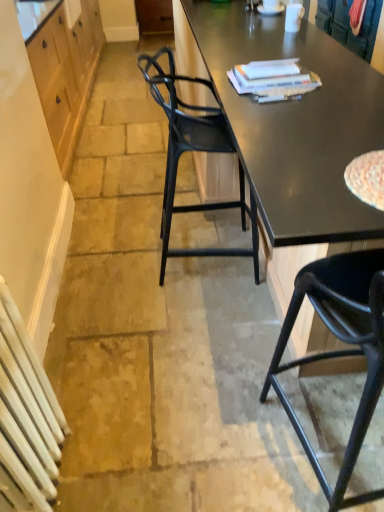
This screenshot has height=512, width=384. Describe the element at coordinates (342, 350) in the screenshot. I see `black plastic chair at lower right, which is the 2th chair in back-to-front order` at that location.

In order to face white matte plate at upper center, should I rotate leftwards or rightwards?

You should rotate right by 10.368 degrees.

Where is `white painted metal radiator at lower left`? The width and height of the screenshot is (384, 512). white painted metal radiator at lower left is located at coordinates (26, 418).

Find the location of a particular element. The height and width of the screenshot is (512, 384). black plastic chair at center, the first chair viewed from the back is located at coordinates (194, 151).

What do you see at coordinates (66, 73) in the screenshot? I see `wooden cabinet at left` at bounding box center [66, 73].

You are a GUI agent. You are given a task and a screenshot of the screen. Output one action in this format:
    pyautogui.click(x=<x>, y=<y>)
    Task: Click on the white glossy coffee cup at upper center
    The image size is (384, 512).
    Given the screenshot: What is the action you would take?
    pyautogui.click(x=293, y=16)

Is black plastic chair at center, acting as the 2th chair starting from the front, placed right next to white matte plate at upper center?

→ No, black plastic chair at center, acting as the 2th chair starting from the front, is not with white matte plate at upper center.

Is black plastic chair at center, the first chair viewed from the back, wider than white matte plate at upper center?

Correct, the width of black plastic chair at center, the first chair viewed from the back, exceeds that of white matte plate at upper center.

From the image's perspective, is black plastic chair at lower right, which is the 2th chair in back-to-front order, on top of wooden cabinet at left?

Actually, black plastic chair at lower right, which is the 2th chair in back-to-front order, appears below wooden cabinet at left in the image.

Does black plastic chair at lower right, which is the 2th chair in back-to-front order, have a greater width compared to wooden cabinet at left?

No.

Between point (331, 277) and point (96, 5), which one is positioned behind?

The point (96, 5) is farther from the camera.

Is black plastic chair at lower right, which is the 2th chair in back-to-front order, facing away from wooden cabinet at left?

That's not correct — black plastic chair at lower right, which is the 2th chair in back-to-front order, is not looking away from wooden cabinet at left.

Considering the sizes of objects wooden cabinet at left and white painted metal radiator at lower left in the image provided, who is thinner, wooden cabinet at left or white painted metal radiator at lower left?

With smaller width is white painted metal radiator at lower left.

From a real-world perspective, is wooden cabinet at left above or below white painted metal radiator at lower left?

From a real-world perspective, wooden cabinet at left is physically above white painted metal radiator at lower left.

What's the angular difference between wooden cabinet at left and white painted metal radiator at lower left's facing directions?

There is a 1.1-degree angle between the facing directions of wooden cabinet at left and white painted metal radiator at lower left.

Do you think wooden cabinet at left is within white painted metal radiator at lower left, or outside of it?

The correct answer is: outside.

Would you say wooden cabinet at upper left is inside or outside white painted metal radiator at lower left?

wooden cabinet at upper left is not enclosed by white painted metal radiator at lower left.

Is the surface of wooden cabinet at upper left in direct contact with white painted metal radiator at lower left?

No, wooden cabinet at upper left is not touching white painted metal radiator at lower left.

Visually, is wooden cabinet at upper left positioned to the left or to the right of white painted metal radiator at lower left?

In the image, wooden cabinet at upper left appears on the left side of white painted metal radiator at lower left.

Does point (54, 4) lie behind point (39, 387)?

That is True.

Is white glossy coffee cup at upper center looking in the opposite direction of wooden cabinet at left?

That's not correct — white glossy coffee cup at upper center is not looking away from wooden cabinet at left.

Locate an element on the screen. The image size is (384, 512). coffee cup that appears on the right of wooden cabinet at left is located at coordinates (293, 16).

From a real-world perspective, which is physically below, white glossy coffee cup at upper center or wooden cabinet at left?

From a 3D spatial view, wooden cabinet at left is below.

Is white glossy coffee cup at upper center far away from wooden cabinet at left?

That's right, there is a large distance between white glossy coffee cup at upper center and wooden cabinet at left.

Does wooden cabinet at upper left have a greater height compared to wooden cabinet at left?

No, wooden cabinet at upper left is not taller than wooden cabinet at left.

Is wooden cabinet at upper left in front of or behind wooden cabinet at left in the image?

wooden cabinet at upper left is positioned farther from the viewer than wooden cabinet at left.

Which object is positioned more to the left, wooden cabinet at upper left or wooden cabinet at left?

Positioned to the left is wooden cabinet at left.

Looking at this image, can wooden cabinet at left be found inside wooden cabinet at upper left?

No, wooden cabinet at left is located outside of wooden cabinet at upper left.

Is wooden cabinet at left surrounding black glossy desk at center?

Actually, black glossy desk at center is outside wooden cabinet at left.

Can you tell me how much wooden cabinet at left and black glossy desk at center differ in facing direction?

0.298 degrees separate the facing orientations of wooden cabinet at left and black glossy desk at center.

Looking at this image, is wooden cabinet at left positioned far away from black glossy desk at center?

Indeed, wooden cabinet at left is not near black glossy desk at center.

Considering their positions, is wooden cabinet at left located in front of or behind black glossy desk at center?

In the image, wooden cabinet at left appears behind black glossy desk at center.

Find the location of a particular element. The image size is (384, 512). the 1st chair positioned below the white matte plate at upper center (from the image's perspective) is located at coordinates (194, 151).

Where is `cabinetry below the black plastic chair at lower right, placed as the 1th chair when sorted from front to back (from a real-world perspective)`? This screenshot has width=384, height=512. cabinetry below the black plastic chair at lower right, placed as the 1th chair when sorted from front to back (from a real-world perspective) is located at coordinates (66, 73).

In the scene shown: Looking at the image, which one is located closer to wooden cabinet at upper left, black plastic chair at lower right, placed as the 1th chair when sorted from front to back, or wooden cabinet at left?

wooden cabinet at left.

Looking at this image, estimate the real-world distances between objects in this image. Which object is closer to white matte plate at upper center, wooden cabinet at left or black plastic chair at center, acting as the 2th chair starting from the front?

black plastic chair at center, acting as the 2th chair starting from the front, is closer to white matte plate at upper center.

Considering their positions, is black plastic chair at center, the first chair viewed from the back, positioned further to white glossy coffee cup at upper center than wooden cabinet at upper left?

wooden cabinet at upper left.

Estimate the real-world distances between objects in this image. Which object is further from white matte plate at upper center, black plastic chair at center, the first chair viewed from the back, or wooden cabinet at left?

wooden cabinet at left is positioned further to the anchor white matte plate at upper center.

Based on their spatial positions, is black plastic chair at center, the first chair viewed from the back, or black plastic chair at lower right, which is the 2th chair in back-to-front order, closer to white painted metal radiator at lower left?

Among the two, black plastic chair at lower right, which is the 2th chair in back-to-front order, is located nearer to white painted metal radiator at lower left.

Estimate the real-world distances between objects in this image. Which object is further from black glossy desk at center, wooden cabinet at left or black plastic chair at lower right, placed as the 1th chair when sorted from front to back?

wooden cabinet at left is further to black glossy desk at center.

Based on their spatial positions, is wooden cabinet at upper left or white matte plate at upper center further from black plastic chair at center, acting as the 2th chair starting from the front?

The object further to black plastic chair at center, acting as the 2th chair starting from the front, is white matte plate at upper center.

Based on their spatial positions, is wooden cabinet at upper left or white matte plate at upper center further from white painted metal radiator at lower left?

white matte plate at upper center.

Locate an element on the screen. coffee cup between black glossy desk at center and black plastic chair at lower right, which is the 2th chair in back-to-front order, in the vertical direction is located at coordinates click(293, 16).

Locate an element on the screen. cabinetry between black plastic chair at lower right, placed as the 1th chair when sorted from front to back, and wooden cabinet at upper left, along the z-axis is located at coordinates (66, 73).

Find the location of a particular element. desk between wooden cabinet at upper left and white glossy coffee cup at upper center is located at coordinates (291, 135).

At what (x,y) coordinates should I click in order to perform the action: click on plate between black glossy desk at center and black plastic chair at lower right, which is the 2th chair in back-to-front order, from top to bottom. Please return your answer as a coordinate pair (x, y). This screenshot has width=384, height=512. Looking at the image, I should click on (270, 10).